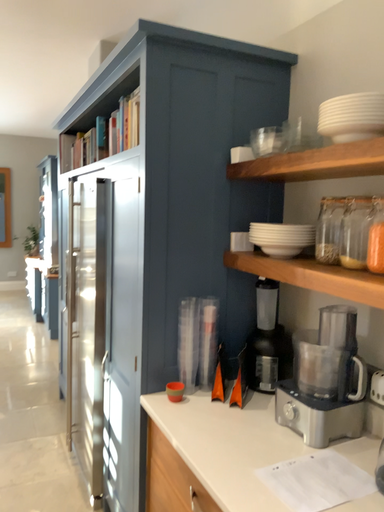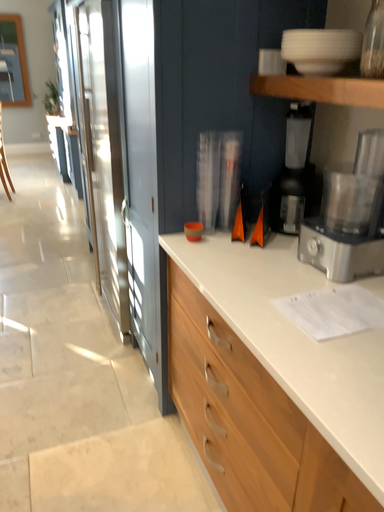
Question: Which way did the camera rotate in the video?

Choices:
 (A) rotated downward
 (B) rotated upward

Answer: (A)